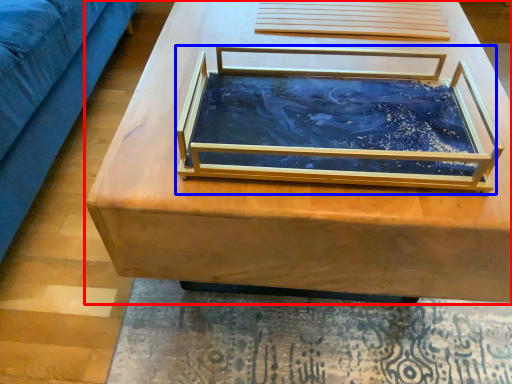
Question: Which of the following is the closest to the observer, table (highlighted by a red box) or glass box (highlighted by a blue box)?

Choices:
 (A) table
 (B) glass box

Answer: (B)